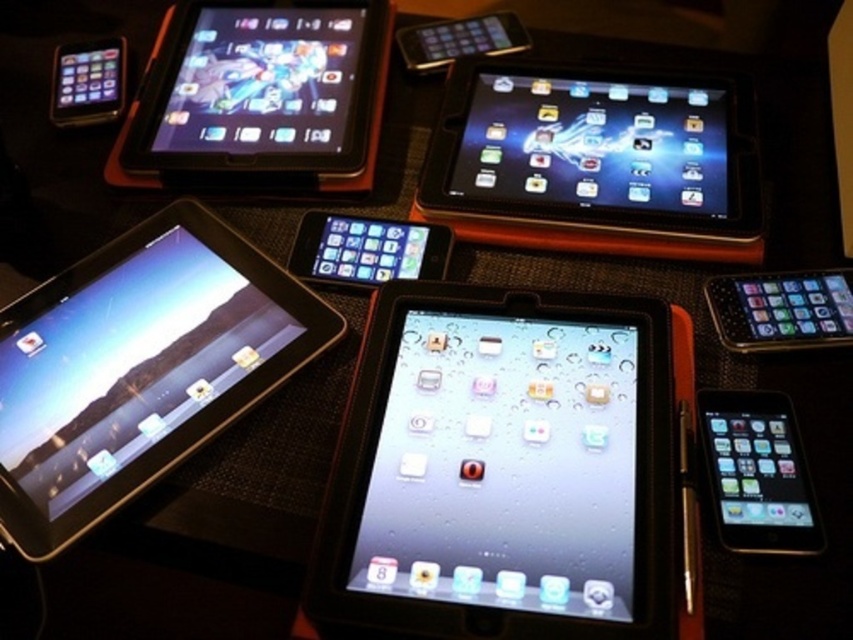
What do you see at coordinates (592, 156) in the screenshot? Image resolution: width=853 pixels, height=640 pixels. I see `satin black tablet at upper center` at bounding box center [592, 156].

Is satin black tablet at upper center below matte black tablet at upper center?

Indeed, satin black tablet at upper center is positioned under matte black tablet at upper center.

Who is more distant from viewer, [577,88] or [262,170]?

The point [577,88] is more distant.

In order to click on satin black tablet at upper center in this screenshot , I will do `click(592, 156)`.

Does point (442, 115) come in front of point (814, 515)?

No, it is not.

Can you confirm if satin black tablet at upper center is positioned above black glossy tablet at lower right?

Yes, satin black tablet at upper center is above black glossy tablet at lower right.

Does point (654, 218) lie behind point (715, 516)?

Yes, it is.

Find the location of a particular element. satin black tablet at upper center is located at coordinates (592, 156).

Which is behind, point (650, 307) or point (827, 282)?

Point (827, 282)

Does black matte tablet at center have a larger size compared to black glossy tablet at upper right?

Yes.

Is point (466, 444) closer to camera compared to point (735, 333)?

Yes, it is.

The height and width of the screenshot is (640, 853). I want to click on black matte tablet at center, so click(x=502, y=470).